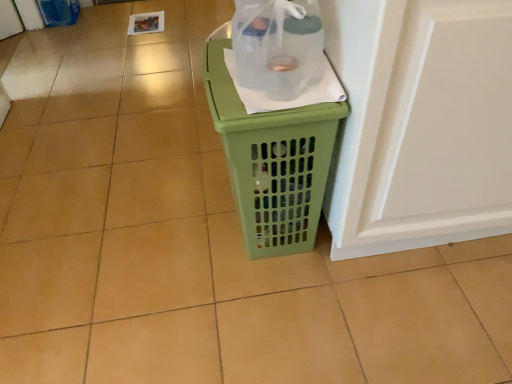
Question: Considering the positions of white glossy screen door at right and transparent plastic bottle at center in the image, is white glossy screen door at right wider or thinner than transparent plastic bottle at center?

Choices:
 (A) wide
 (B) thin

Answer: (A)

Question: Is white glossy screen door at right bigger or smaller than transparent plastic bottle at center?

Choices:
 (A) small
 (B) big

Answer: (B)

Question: Which of these objects is positioned closest to the transparent plastic bottle at center?

Choices:
 (A) green plastic laundry basket at center
 (B) white glossy screen door at right

Answer: (A)

Question: Which of these objects is positioned closest to the white glossy screen door at right?

Choices:
 (A) transparent plastic bottle at center
 (B) green plastic laundry basket at center

Answer: (B)